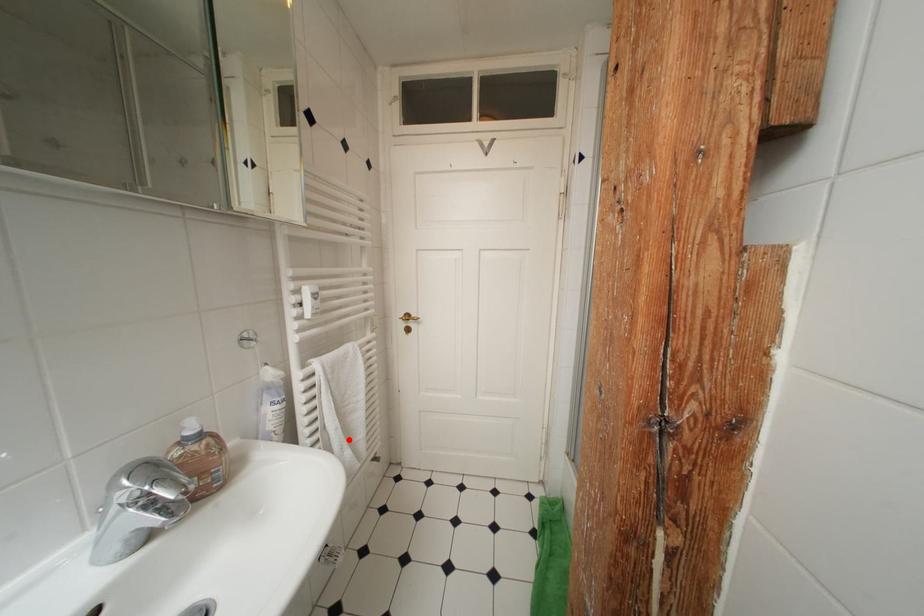
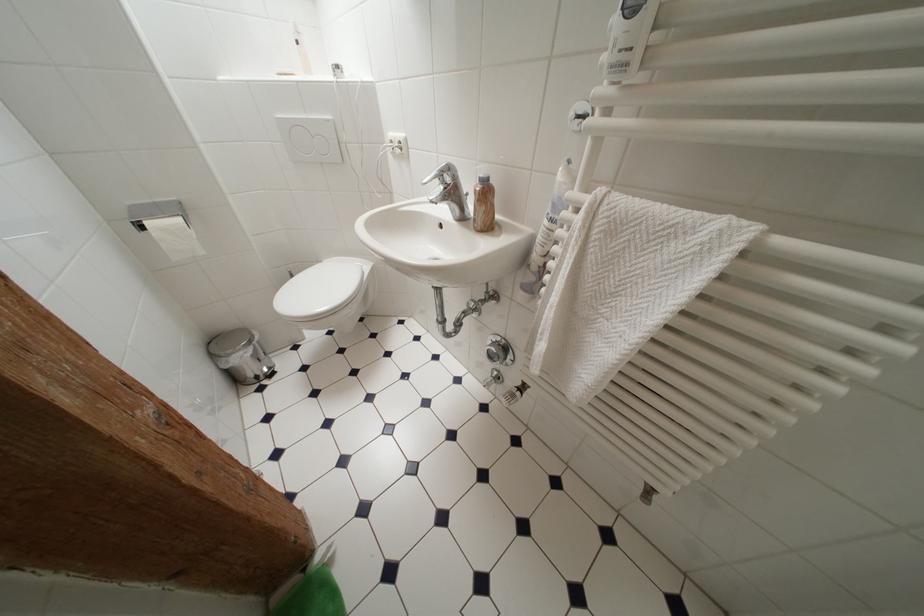
Where in the second image is the point corresponding to the highlighted location from the first image?

(555, 325)